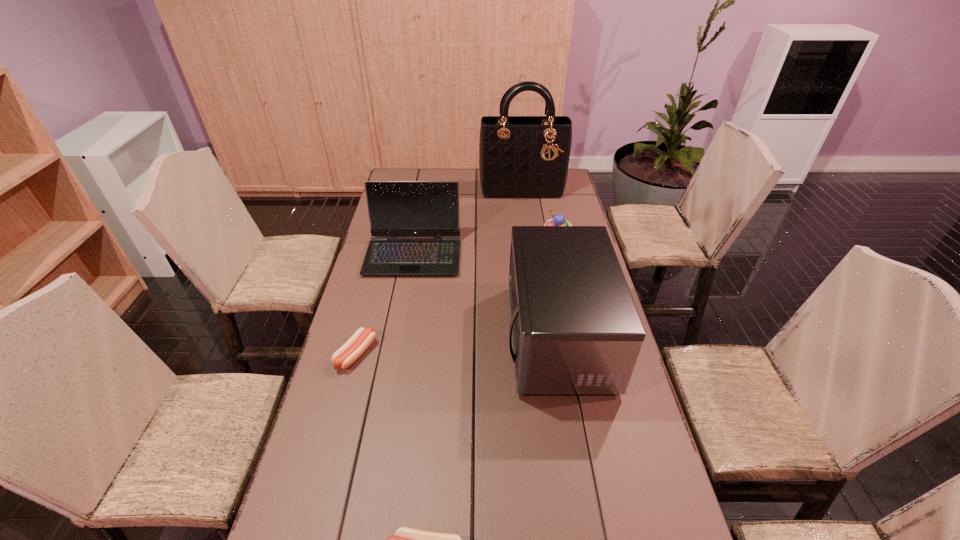
Identify the location of the farthest object. (524, 157).

Identify the location of handbag. (524, 157).

At what (x,y) coordinates should I click in order to perform the action: click on microwave oven. Please return your answer as a coordinate pair (x, y). Looking at the image, I should click on [x=576, y=330].

At what (x,y) coordinates should I click in order to perform the action: click on laptop computer. Please return your answer as a coordinate pair (x, y). Looking at the image, I should click on (396, 209).

Locate an element on the screen. This screenshot has height=540, width=960. the third shortest object is located at coordinates (558, 220).

Identify the location of the left sausage. (346, 355).

I want to click on vacant space situated at the front of the tallest object with visible charms, so click(526, 215).

At what (x,y) coordinates should I click in order to perform the action: click on free spot located 0.150m on the front-facing side of the microwave oven. Please return your answer as a coordinate pair (x, y). The width and height of the screenshot is (960, 540). Looking at the image, I should click on (457, 336).

At what (x,y) coordinates should I click in order to perform the action: click on vacant area situated on the front-facing side of the microwave oven. Please return your answer as a coordinate pair (x, y). This screenshot has width=960, height=540. Looking at the image, I should click on (476, 336).

Where is `vacant region located 0.110m on the front-facing side of the microwave oven`? This screenshot has width=960, height=540. vacant region located 0.110m on the front-facing side of the microwave oven is located at coordinates (469, 336).